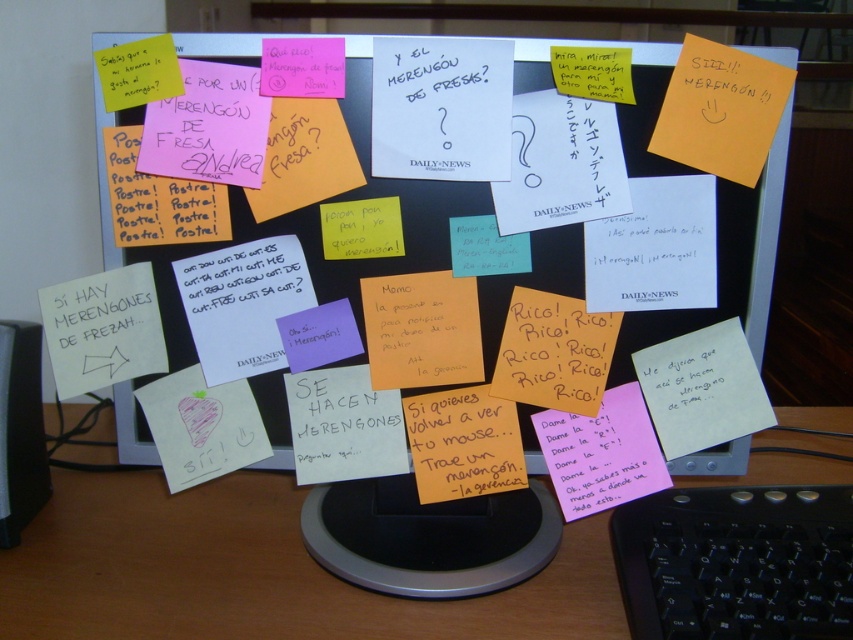
Which is below, white plastic table at center or yellow paper at center?

white plastic table at center

Between point (741, 483) and point (380, 232), which one is positioned in front?

Point (380, 232)

The width and height of the screenshot is (853, 640). In order to click on white plastic table at center in this screenshot , I will do `click(254, 572)`.

Describe the element at coordinates (306, 214) in the screenshot. I see `multicolored sticky notes at center` at that location.

Is point (370, 42) behind point (758, 561)?

That is False.

The image size is (853, 640). What are the coordinates of `multicolored sticky notes at center` in the screenshot? It's located at (306, 214).

At what (x,y) coordinates should I click in order to perform the action: click on multicolored sticky notes at center. Please return your answer as a coordinate pair (x, y). Looking at the image, I should click on (306, 214).

Is multicolored sticky notes at center smaller than yellow paper at center?

No.

Between point (680, 314) and point (392, 228), which one is positioned behind?

Positioned behind is point (680, 314).

At what (x,y) coordinates should I click in order to perform the action: click on multicolored sticky notes at center. Please return your answer as a coordinate pair (x, y). Looking at the image, I should click on (306, 214).